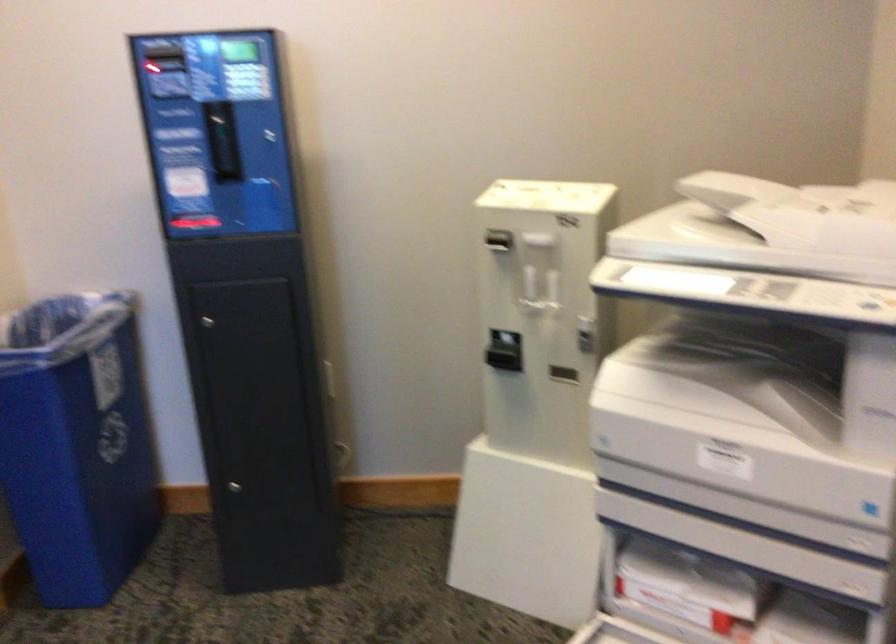
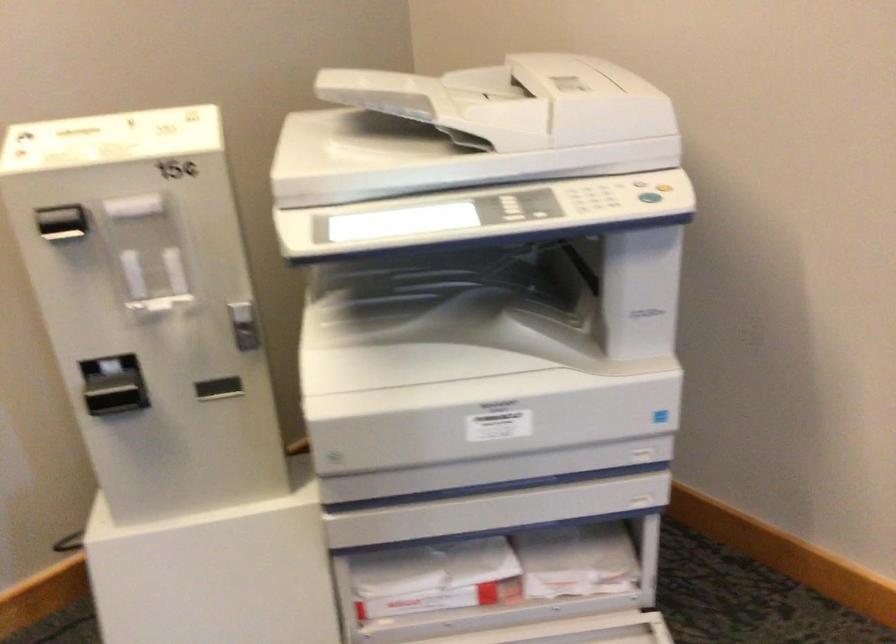
Locate, in the second image, the point that corresponds to [746,225] in the first image.

(470, 129)